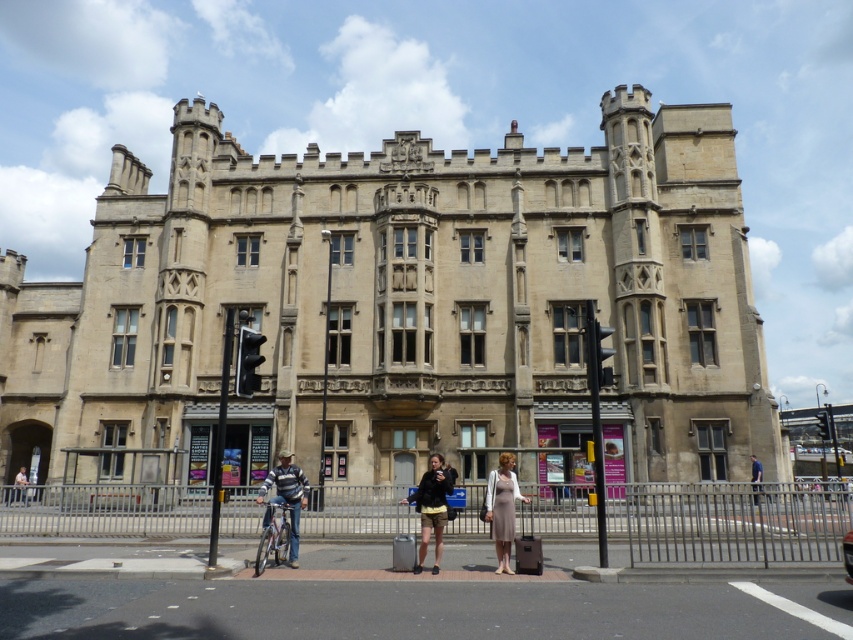
Question: Does striped sweater at center have a smaller size compared to light brown leather jacket at center?

Choices:
 (A) yes
 (B) no

Answer: (B)

Question: Considering the real-world distances, which object is closest to the dark brown leather jacket at center?

Choices:
 (A) metallic silver car at center
 (B) light brown leather jacket at lower left
 (C) striped sweater at center

Answer: (C)

Question: Is light beige dress at center closer to the viewer compared to light brown leather jacket at center?

Choices:
 (A) yes
 (B) no

Answer: (A)

Question: Is metallic silver car at center thinner than light brown leather jacket at lower left?

Choices:
 (A) no
 (B) yes

Answer: (B)

Question: Which object is farther from the camera taking this photo?

Choices:
 (A) striped sweater at center
 (B) light beige dress at center
 (C) light brown leather jacket at lower left
 (D) metallic silver car at center

Answer: (C)

Question: Which point appears closest to the camera in this image?

Choices:
 (A) (851, 557)
 (B) (761, 486)
 (C) (500, 525)

Answer: (A)